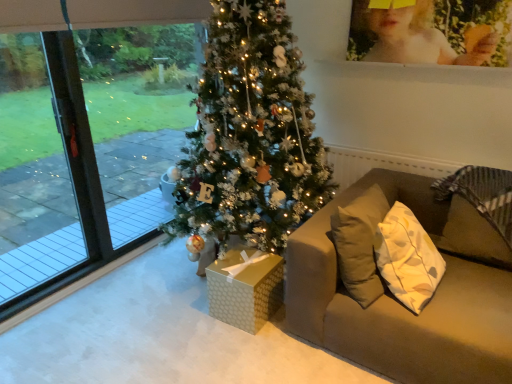
What do you see at coordinates (245, 289) in the screenshot? Image resolution: width=512 pixels, height=384 pixels. I see `gold textured gift box at center` at bounding box center [245, 289].

What is the approximate height of matte brown couch at right?

The height of matte brown couch at right is 29.50 inches.

Where is `matte brown couch at right`? This screenshot has width=512, height=384. matte brown couch at right is located at coordinates (398, 301).

Where is `transparent glass screen door at left`? The width and height of the screenshot is (512, 384). transparent glass screen door at left is located at coordinates (52, 189).

From the image's perspective, which one is positioned lower, matte yellow photo frame at upper right or transparent glass window at left?

transparent glass window at left.

Consider the image. Is matte yellow photo frame at upper right positioned with its back to transparent glass window at left?

matte yellow photo frame at upper right is not turned away from transparent glass window at left.

The width and height of the screenshot is (512, 384). What are the coordinates of `window in front of the matte yellow photo frame at upper right` in the screenshot? It's located at (89, 140).

Who is more distant, matte yellow photo frame at upper right or transparent glass window at left?

matte yellow photo frame at upper right.

Which object is positioned more to the left, matte yellow photo frame at upper right or gold textured gift box at center?

gold textured gift box at center is more to the left.

Who is bigger, matte yellow photo frame at upper right or gold textured gift box at center?

matte yellow photo frame at upper right.

Relative to gold textured gift box at center, is matte yellow photo frame at upper right in front or behind?

In the image, matte yellow photo frame at upper right appears behind gold textured gift box at center.

Considering the relative sizes of matte yellow photo frame at upper right and gold textured gift box at center in the image provided, is matte yellow photo frame at upper right taller than gold textured gift box at center?

Correct, matte yellow photo frame at upper right is much taller as gold textured gift box at center.

From the image's perspective, is matte brown couch at right located beneath transparent glass window at left?

Correct, matte brown couch at right appears lower than transparent glass window at left in the image.

Based on the photo, could you tell me if matte brown couch at right is facing transparent glass window at left?

No, matte brown couch at right is not turned towards transparent glass window at left.

Where is `window on the left of matte brown couch at right`? The width and height of the screenshot is (512, 384). window on the left of matte brown couch at right is located at coordinates (89, 140).

From the image's perspective, which object appears higher, matte yellow photo frame at upper right or matte brown couch at right?

matte yellow photo frame at upper right, from the image's perspective.

Does matte yellow photo frame at upper right come behind matte brown couch at right?

That is True.

Looking at this image, in the image, is matte yellow photo frame at upper right on the left side or the right side of matte brown couch at right?

Clearly, matte yellow photo frame at upper right is on the right of matte brown couch at right in the image.

Between transparent glass screen door at left and gold textured gift box at center, which one has smaller width?

With smaller width is transparent glass screen door at left.

Does transparent glass screen door at left have a greater height compared to gold textured gift box at center?

Correct, transparent glass screen door at left is much taller as gold textured gift box at center.

From a real-world perspective, is transparent glass screen door at left positioned over gold textured gift box at center based on gravity?

Correct, in the physical world, transparent glass screen door at left is higher than gold textured gift box at center.

At what (x,y) coordinates should I click in order to perform the action: click on window on the left of matte yellow photo frame at upper right. Please return your answer as a coordinate pair (x, y). This screenshot has width=512, height=384. Looking at the image, I should click on (89, 140).

From a real-world perspective, is transparent glass window at left physically above matte yellow photo frame at upper right?

No, from a real-world perspective, transparent glass window at left is not above matte yellow photo frame at upper right.

Is the position of transparent glass window at left more distant than that of matte yellow photo frame at upper right?

No, the depth of transparent glass window at left is less than that of matte yellow photo frame at upper right.

From the picture: Which of these two, transparent glass window at left or matte yellow photo frame at upper right, stands shorter?

matte yellow photo frame at upper right is shorter.

Measure the distance from transparent glass window at left to gold textured gift box at center.

They are 1.85 meters apart.

Relative to gold textured gift box at center, is transparent glass window at left in front or behind?

Visually, transparent glass window at left is located in front of gold textured gift box at center.

Based on their sizes in the image, would you say transparent glass window at left is bigger or smaller than gold textured gift box at center?

Considering their sizes, transparent glass window at left takes up more space than gold textured gift box at center.

Is transparent glass window at left turned away from gold textured gift box at center?

No, transparent glass window at left is not facing away from gold textured gift box at center.

This screenshot has height=384, width=512. I want to click on window that appears below the matte yellow photo frame at upper right (from a real-world perspective), so click(x=89, y=140).

Locate an element on the screen. This screenshot has height=384, width=512. furniture below the matte yellow photo frame at upper right (from the image's perspective) is located at coordinates (245, 289).

In the scene shown: Based on their spatial positions, is transparent glass screen door at left or matte brown couch at right further from transparent glass window at left?

Among the two, matte brown couch at right is located further to transparent glass window at left.

Looking at the image, which one is located further to transparent glass screen door at left, matte brown couch at right or matte yellow photo frame at upper right?

matte yellow photo frame at upper right lies further to transparent glass screen door at left than the other object.

Based on their spatial positions, is matte brown couch at right or transparent glass screen door at left closer to matte yellow photo frame at upper right?

matte brown couch at right is positioned closer to the anchor matte yellow photo frame at upper right.

Which object lies further to the anchor point gold textured gift box at center, transparent glass window at left or matte brown couch at right?

Based on the image, transparent glass window at left appears to be further to gold textured gift box at center.

Looking at the image, which one is located closer to matte yellow photo frame at upper right, gold textured gift box at center or transparent glass screen door at left?

gold textured gift box at center is closer to matte yellow photo frame at upper right.

Considering their positions, is matte yellow photo frame at upper right positioned further to matte brown couch at right than transparent glass screen door at left?

Based on the image, transparent glass screen door at left appears to be further to matte brown couch at right.

Which object lies nearer to the anchor point matte brown couch at right, transparent glass screen door at left or transparent glass window at left?

transparent glass window at left is closer to matte brown couch at right.

Looking at the image, which one is located further to transparent glass screen door at left, gold textured gift box at center or matte brown couch at right?

Based on the image, matte brown couch at right appears to be further to transparent glass screen door at left.

This screenshot has width=512, height=384. I want to click on furniture between transparent glass window at left and matte yellow photo frame at upper right, so click(x=245, y=289).

Locate an element on the screen. studio couch situated between transparent glass screen door at left and matte yellow photo frame at upper right from left to right is located at coordinates (398, 301).

Where is `window located between transparent glass screen door at left and gold textured gift box at center in the left-right direction`? This screenshot has width=512, height=384. window located between transparent glass screen door at left and gold textured gift box at center in the left-right direction is located at coordinates (89, 140).

Where is `furniture between transparent glass screen door at left and matte brown couch at right from left to right`? furniture between transparent glass screen door at left and matte brown couch at right from left to right is located at coordinates (245, 289).